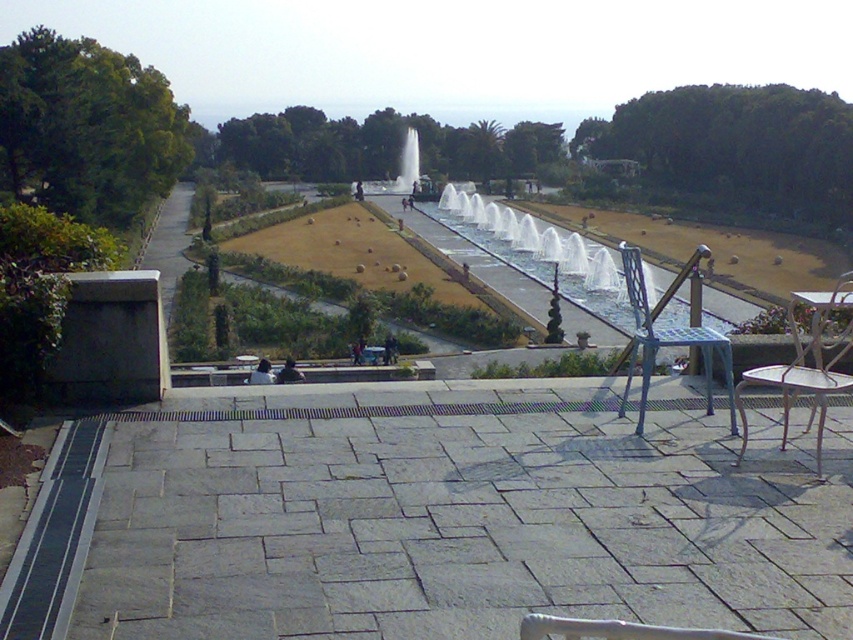
Is point (602, 273) positioned behind point (851, 342)?

Yes, it is.

Which is behind, point (527, 243) or point (784, 436)?

The point (527, 243) is more distant.

Who is more distant from viewer, [482,200] or [822,401]?

Point [482,200]

I want to click on clear glass water at center, so pos(540,252).

The width and height of the screenshot is (853, 640). Identify the location of metallic white chair at lower right. tap(805, 364).

Can you confirm if metallic white chair at lower right is bigger than metallic blue chair at right?

No.

At what (x,y) coordinates should I click in order to perform the action: click on metallic white chair at lower right. Please return your answer as a coordinate pair (x, y). The height and width of the screenshot is (640, 853). Looking at the image, I should click on (805, 364).

Who is higher up, clear glass water at center or metallic blue chair at right?

clear glass water at center is higher up.

Which is more to the left, clear glass water at center or metallic blue chair at right?

clear glass water at center is more to the left.

Who is more distant from viewer, (474, 234) or (703, 333)?

Result: Point (474, 234)

What are the coordinates of `clear glass water at center` in the screenshot? It's located at (540, 252).